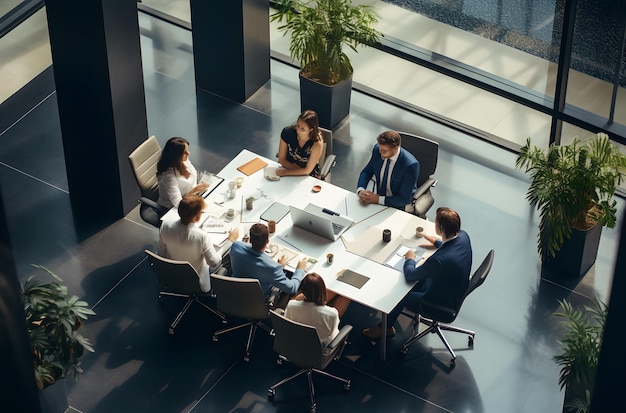
Find the location of a particular element. The image size is (626, 413). chairs is located at coordinates (148, 161), (168, 266), (237, 301), (294, 332), (484, 267), (428, 152), (327, 144).